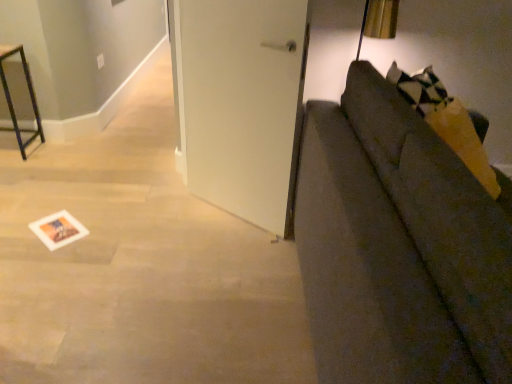
Question: Is textured gray couch at right shorter than white matte door at center?

Choices:
 (A) yes
 (B) no

Answer: (A)

Question: Is textured gray couch at right taller than white matte door at center?

Choices:
 (A) yes
 (B) no

Answer: (B)

Question: Is textured gray couch at right positioned beyond the bounds of white matte door at center?

Choices:
 (A) yes
 (B) no

Answer: (A)

Question: Is the surface of textured gray couch at right in direct contact with white matte door at center?

Choices:
 (A) no
 (B) yes

Answer: (A)

Question: Is textured gray couch at right surrounding white matte door at center?

Choices:
 (A) yes
 (B) no

Answer: (B)

Question: From the image's perspective, is textured gray couch at right on top of white matte door at center?

Choices:
 (A) no
 (B) yes

Answer: (A)

Question: Considering the relative sizes of white matte door at center and white paper postcard at lower left in the image provided, is white matte door at center taller than white paper postcard at lower left?

Choices:
 (A) no
 (B) yes

Answer: (B)

Question: Can you confirm if white matte door at center is smaller than white paper postcard at lower left?

Choices:
 (A) yes
 (B) no

Answer: (B)

Question: Does white matte door at center have a greater width compared to white paper postcard at lower left?

Choices:
 (A) no
 (B) yes

Answer: (A)

Question: From a real-world perspective, does white matte door at center sit lower than white paper postcard at lower left?

Choices:
 (A) no
 (B) yes

Answer: (A)

Question: Does white matte door at center appear on the left side of white paper postcard at lower left?

Choices:
 (A) yes
 (B) no

Answer: (B)

Question: Is white matte door at center facing away from white paper postcard at lower left?

Choices:
 (A) no
 (B) yes

Answer: (A)

Question: From a real-world perspective, is white matte door at center on top of metal frame at left?

Choices:
 (A) yes
 (B) no

Answer: (A)